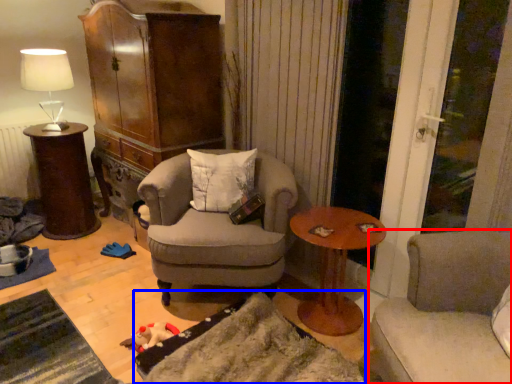
Question: Which object is closer to the camera taking this photo, studio couch (highlighted by a red box) or wide (highlighted by a blue box)?

Choices:
 (A) studio couch
 (B) wide

Answer: (A)